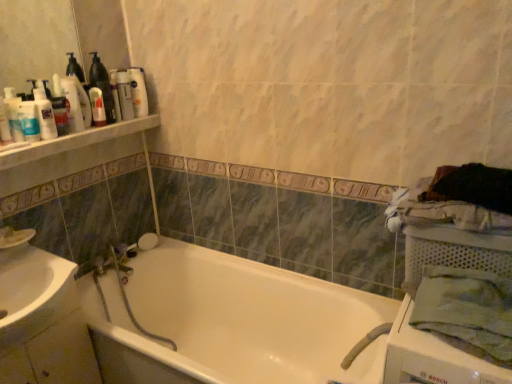
Question: Is the depth of matte white lotion at upper left, which is counted as the fifth toiletry, starting from the front, greater than that of white glossy bottles at upper left?

Choices:
 (A) yes
 (B) no

Answer: (A)

Question: Is matte white lotion at upper left, which is counted as the fifth toiletry, starting from the front, not close to white glossy bottles at upper left?

Choices:
 (A) yes
 (B) no

Answer: (B)

Question: Can you confirm if matte white lotion at upper left, which is counted as the fifth toiletry, starting from the front, is shorter than white glossy bottles at upper left?

Choices:
 (A) no
 (B) yes

Answer: (B)

Question: From a real-world perspective, is matte white lotion at upper left, which is counted as the fifth toiletry, starting from the front, physically below white glossy bottles at upper left?

Choices:
 (A) yes
 (B) no

Answer: (A)

Question: Considering the relative sizes of matte white lotion at upper left, the 1th toiletry from the back, and white glossy bottles at upper left in the image provided, is matte white lotion at upper left, the 1th toiletry from the back, wider than white glossy bottles at upper left?

Choices:
 (A) no
 (B) yes

Answer: (B)

Question: Is matte white lotion at upper left, which is counted as the fifth toiletry, starting from the front, not inside white glossy bottles at upper left?

Choices:
 (A) yes
 (B) no

Answer: (A)

Question: From a real-world perspective, does white glossy sink at lower left sit lower than white plastic shelf at upper left?

Choices:
 (A) yes
 (B) no

Answer: (A)

Question: Is white plastic shelf at upper left inside white glossy sink at lower left?

Choices:
 (A) no
 (B) yes

Answer: (A)

Question: From the image's perspective, is white glossy sink at lower left below white plastic shelf at upper left?

Choices:
 (A) no
 (B) yes

Answer: (B)

Question: Is white glossy sink at lower left shorter than white plastic shelf at upper left?

Choices:
 (A) no
 (B) yes

Answer: (A)

Question: Can we say white glossy sink at lower left lies outside white plastic shelf at upper left?

Choices:
 (A) yes
 (B) no

Answer: (A)

Question: Is white glossy sink at lower left positioned with its back to white plastic shelf at upper left?

Choices:
 (A) no
 (B) yes

Answer: (A)

Question: Considering the relative sizes of white glossy bathtub at center and green cotton bath towel at right in the image provided, is white glossy bathtub at center smaller than green cotton bath towel at right?

Choices:
 (A) no
 (B) yes

Answer: (A)